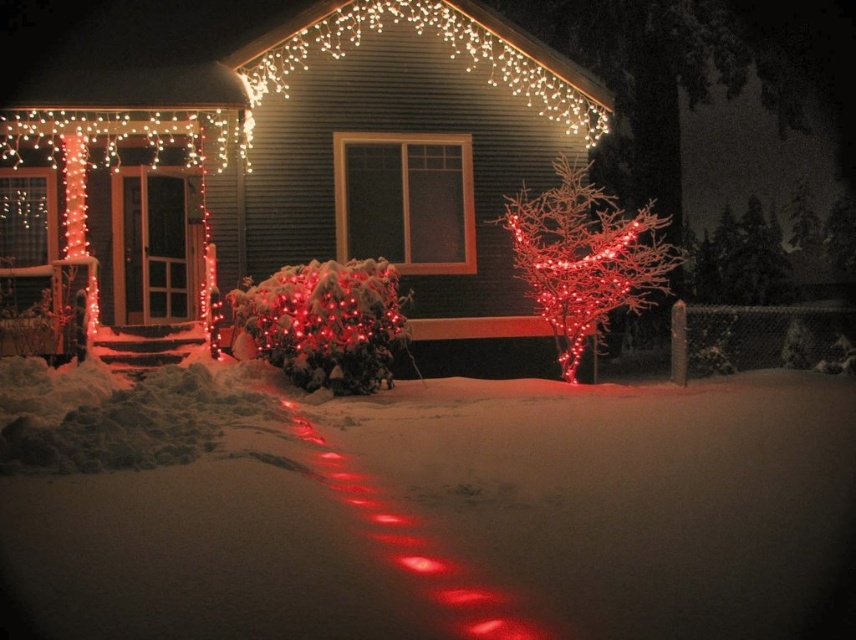
Does white powdery snow at lower center have a greater width compared to illuminated wireframe tree at center-right?

Indeed, white powdery snow at lower center has a greater width compared to illuminated wireframe tree at center-right.

Is white powdery snow at lower center shorter than illuminated wireframe tree at center-right?

Incorrect, white powdery snow at lower center's height does not fall short of illuminated wireframe tree at center-right's.

Which is behind, point (183, 554) or point (589, 228)?

The point (589, 228) is behind.

The image size is (856, 640). Identify the location of white powdery snow at lower center. (435, 509).